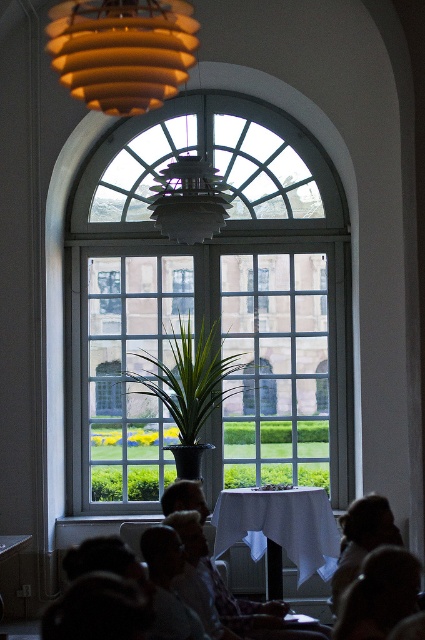
You are a photographer setting up for a group photo. You notice the matte orange lampshade at upper center and the silky brown hair at lower right. Which object is positioned to the left of the other?

The matte orange lampshade at upper center is to the left of silky brown hair at lower right.